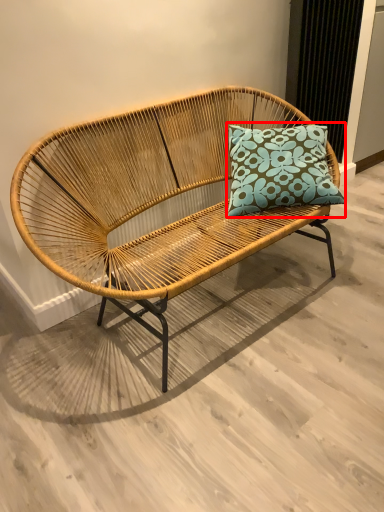
Question: From the image's perspective, what is the correct spatial relationship of pillow (annotated by the red box) in relation to studio couch?

Choices:
 (A) above
 (B) below

Answer: (A)